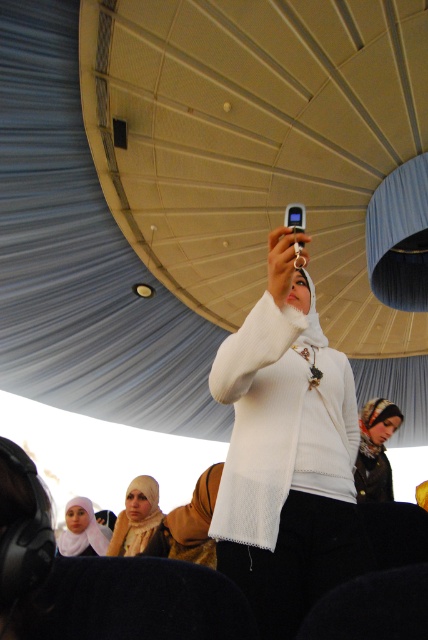
Question: Which of these objects is positioned closest to the white textured scarf at center?

Choices:
 (A) white mesh scarf at center
 (B) white sheer hijab at center

Answer: (B)

Question: Which is nearer to the white textured scarf at center?

Choices:
 (A) white sheer hijab at center
 (B) white mesh scarf at center
 (C) matte white hijab at lower center

Answer: (A)

Question: Does white mesh scarf at center lie behind white textured scarf at center?

Choices:
 (A) yes
 (B) no

Answer: (B)

Question: Is white textured scarf at center closer to the viewer compared to white sheer hijab at center?

Choices:
 (A) no
 (B) yes

Answer: (A)

Question: Can you confirm if white sheer hijab at center is thinner than matte white hijab at lower center?

Choices:
 (A) yes
 (B) no

Answer: (A)

Question: Which object appears closest to the camera in this image?

Choices:
 (A) white sheer hijab at center
 (B) white textured scarf at center

Answer: (A)